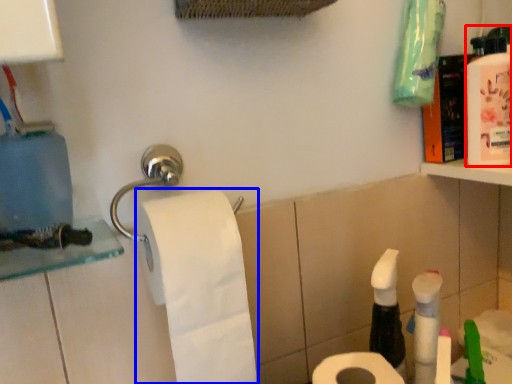
Question: Which of the following is the farthest to the observer, mouthwash (highlighted by a red box) or toilet paper (highlighted by a blue box)?

Choices:
 (A) mouthwash
 (B) toilet paper

Answer: (A)